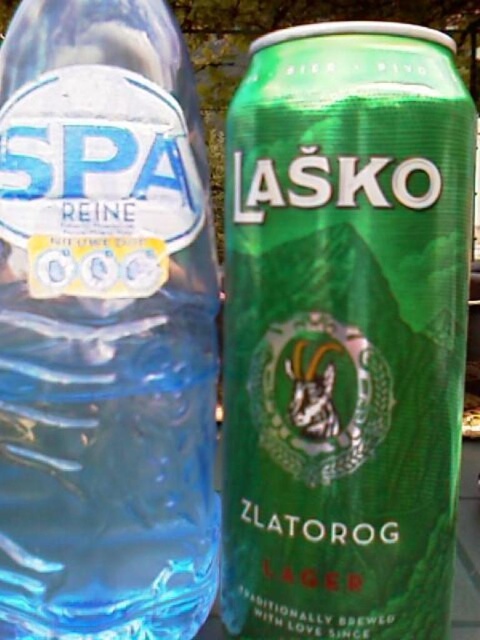
Can you confirm if green matte can at right is positioned to the left of transparent plastic bottle at left?

No, green matte can at right is not to the left of transparent plastic bottle at left.

This screenshot has width=480, height=640. I want to click on green matte can at right, so click(x=345, y=332).